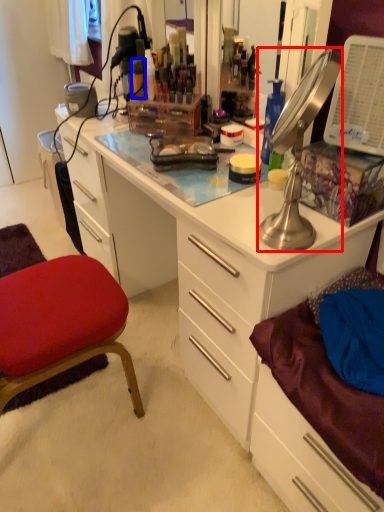
Question: Which point is closer to the camera, lamp (highlighted by a red box) or toiletry (highlighted by a blue box)?

Choices:
 (A) lamp
 (B) toiletry

Answer: (A)